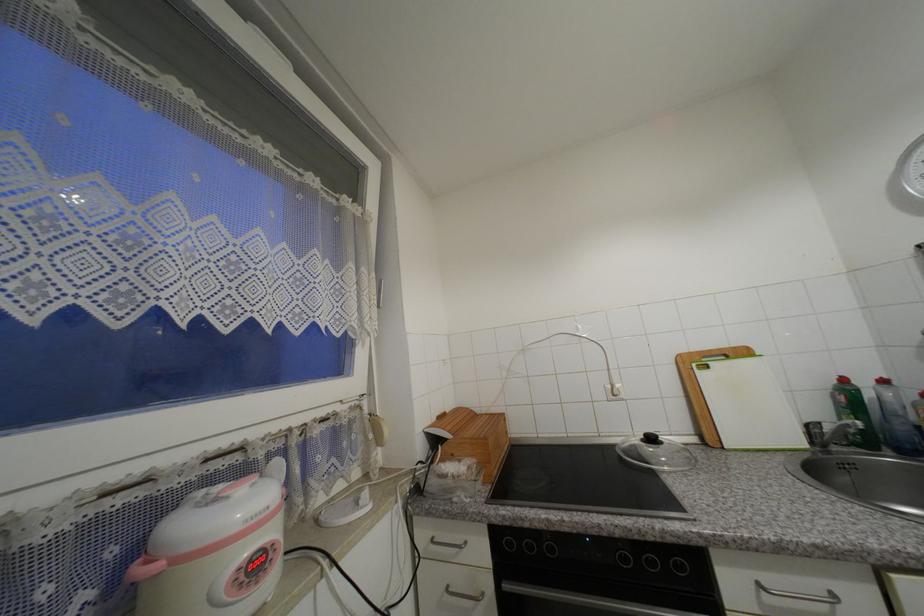
Identify the location of wooden cutting board. (473, 438).